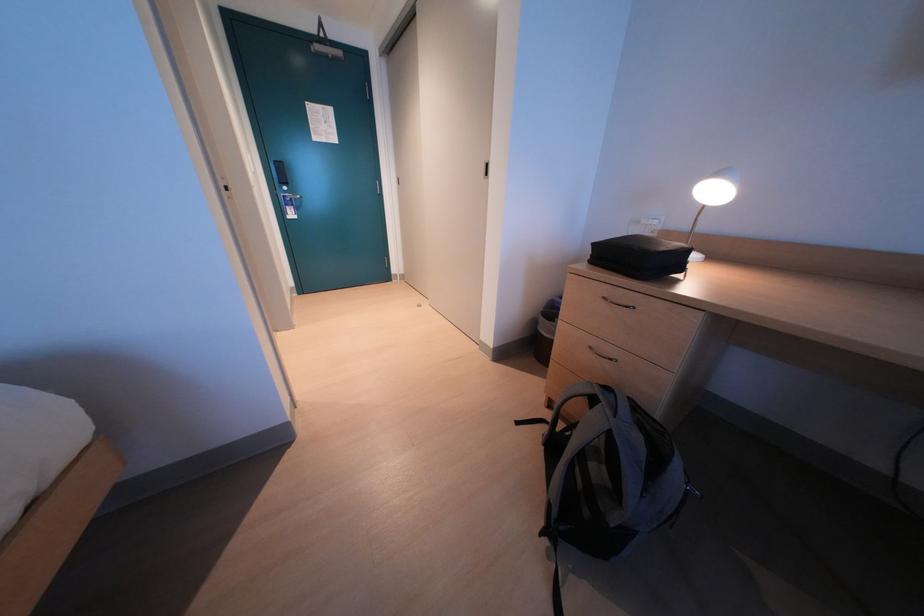
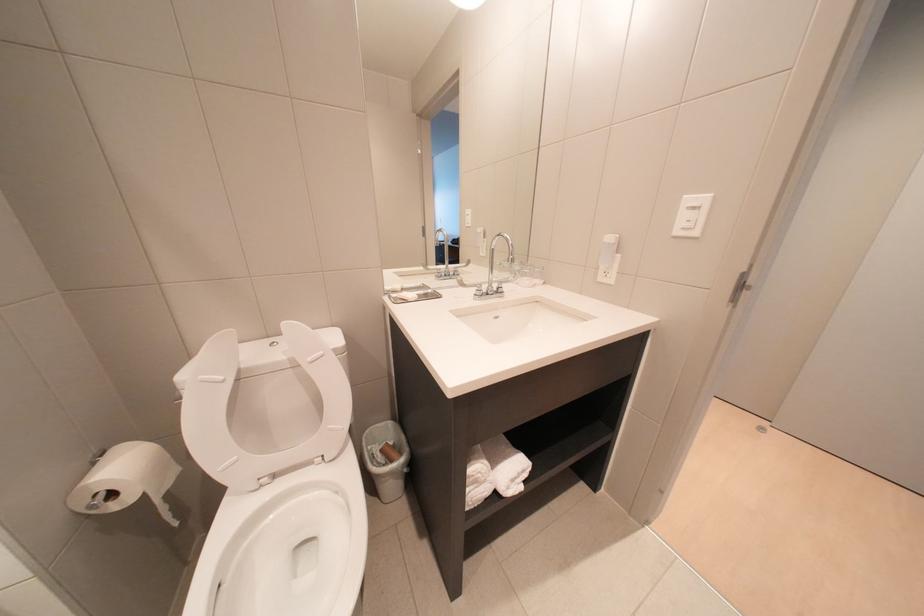
In a continuous first-person perspective shot, in which direction is the camera moving?

The cameraman walked toward left, forward.